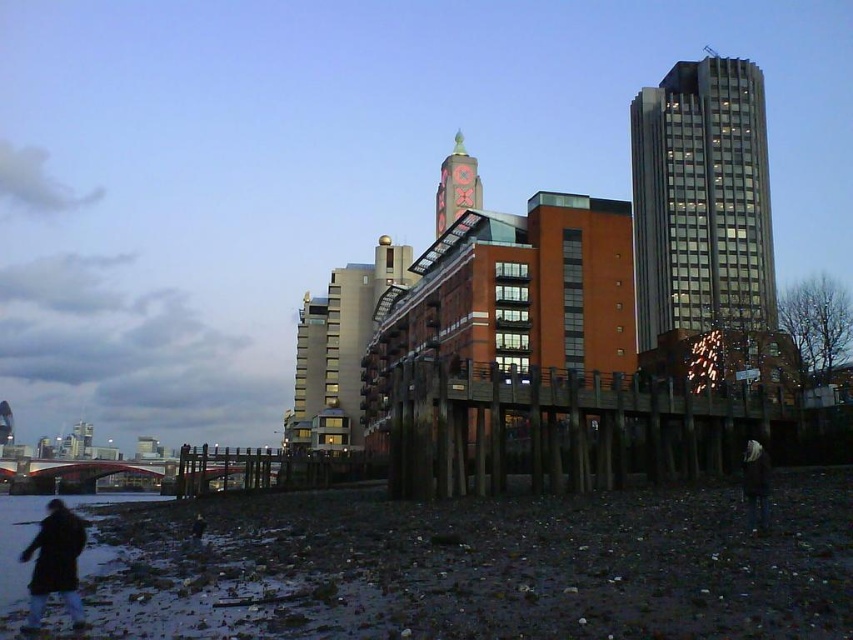
You are standing at the camera position and want to walk to the nearest point between point (643, 120) and point (463, 205). Which point should you head towards?

Point (643, 120) is closer to the camera than point 0.322, 0.755, so you should head towards point (643, 120).

You are standing at the center of the city and see the point marked at coordinates (x=701, y=204). What object does this point correspond to in the scene?

The point corresponds to the matte glass skyscraper at upper right.

You are a photographer planning to capture the brick tower at center and the dark brown jacket at lower right in a single frame. Given that your camera has a fixed focal length, which object should you position closer to the center of the frame to ensure both are in focus without adjusting the aperture or shutter speed?

The brick tower at center is thinner than the dark brown jacket at lower right. To ensure both are in focus, position the brick tower at center closer to the center of the frame since it is smaller and might be farther away, requiring less depth of field adjustment compared to the larger dark brown jacket at lower right.